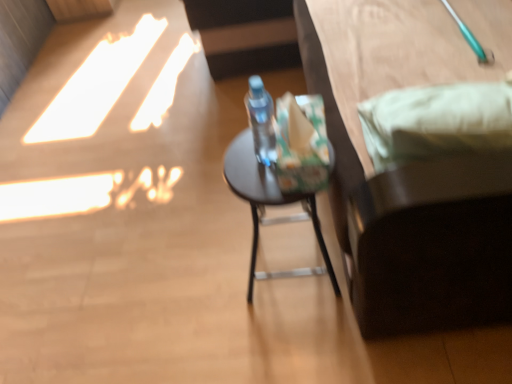
At what (x,y) coordinates should I click in order to perform the action: click on free point in front of matte black stool at center. Please return your answer as a coordinate pair (x, y). This screenshot has width=512, height=384. Looking at the image, I should click on (302, 336).